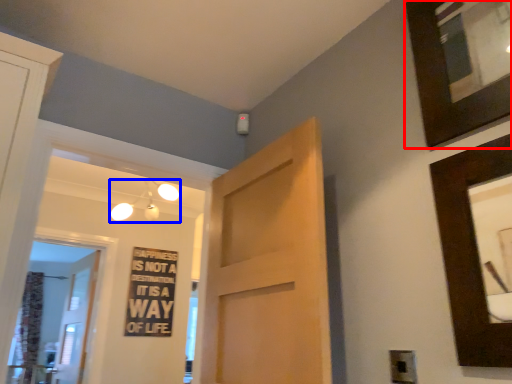
Question: Which object appears closest to the camera in this image, picture frame (highlighted by a red box) or light fixture (highlighted by a blue box)?

Choices:
 (A) picture frame
 (B) light fixture

Answer: (A)